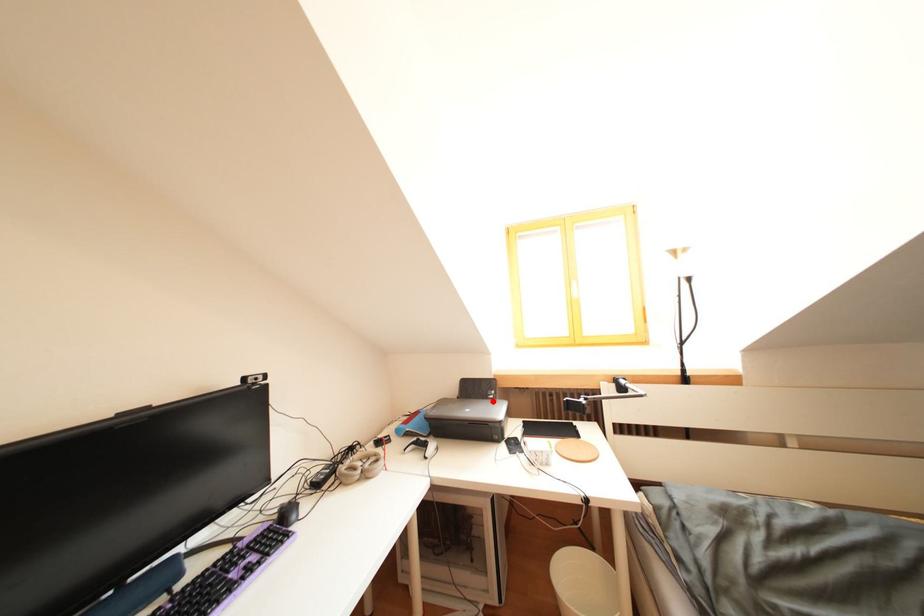
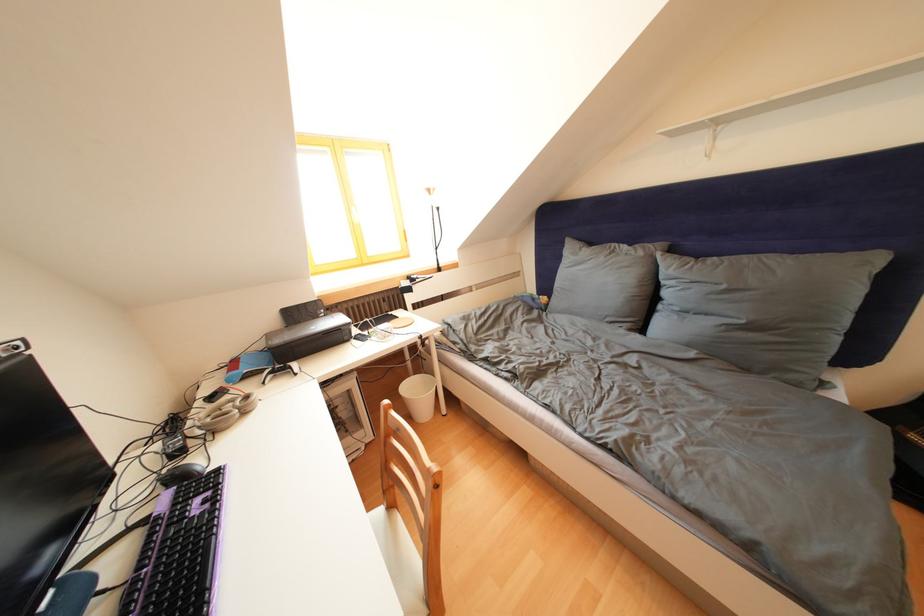
In the second image, find the point that corresponds to the highlighted location in the first image.

(323, 322)